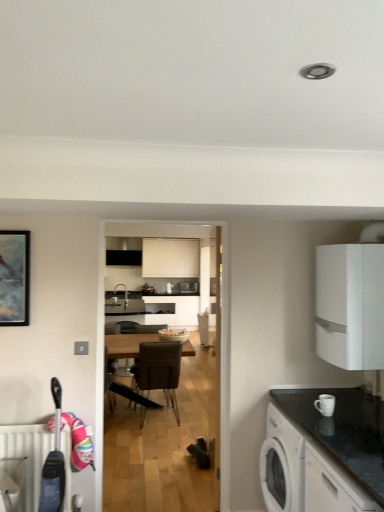
This screenshot has height=512, width=384. I want to click on white matte cabinet at right, positioned as the 1th cabinetry in back-to-front order, so click(x=350, y=305).

What is the approximate width of matte white bowl at center?

It is 15.05 inches.

Find the location of a particular element. This screenshot has width=384, height=512. white matte cabinet at lower right, placed as the 1th cabinetry when sorted from front to back is located at coordinates (332, 485).

The height and width of the screenshot is (512, 384). I want to click on white ceramic mug at lower right, so click(x=325, y=404).

Does point (331, 412) come behind point (171, 335)?

No, it is in front of (171, 335).

Can you confirm if white ceramic mug at lower right is wider than matte white bowl at center?

No.

Based on the photo, is white ceramic mug at lower right oriented away from matte white bowl at center?

No.

From a real-world perspective, count 2nd cabinetrys upward from the wooden table at center and point to it. Please provide its 2D coordinates.

[(350, 305)]

Considering the sizes of objects wooden table at center and white matte cabinet at right, which ranks as the 2th cabinetry in front-to-back order, in the image provided, who is bigger, wooden table at center or white matte cabinet at right, which ranks as the 2th cabinetry in front-to-back order,?

wooden table at center.

From a real-world perspective, which is physically below, wooden table at center or white matte cabinet at right, which ranks as the 2th cabinetry in front-to-back order?

From a 3D spatial view, wooden table at center is below.

Does wooden table at center turn towards white matte cabinet at right, which ranks as the 2th cabinetry in front-to-back order?

No, wooden table at center is not oriented towards white matte cabinet at right, which ranks as the 2th cabinetry in front-to-back order.

Looking at the image, does white matte cabinet at right, the second cabinetry positioned from the bottom, seem bigger or smaller compared to wooden table at center?

In the image, white matte cabinet at right, the second cabinetry positioned from the bottom, appears to be smaller than wooden table at center.

Considering the relative sizes of white matte cabinet at right, the first cabinetry when ordered from top to bottom, and wooden table at center in the image provided, is white matte cabinet at right, the first cabinetry when ordered from top to bottom, taller than wooden table at center?

Incorrect, the height of white matte cabinet at right, the first cabinetry when ordered from top to bottom, is not larger of that of wooden table at center.

Identify the location of the 1st cabinetry in front of the wooden table at center. (350, 305).

Can we say wooden table at center lies outside brown leather chair at center?

Yes, wooden table at center is located beyond the bounds of brown leather chair at center.

Who is bigger, wooden table at center or brown leather chair at center?

wooden table at center.

Would you consider wooden table at center to be distant from brown leather chair at center?

Yes, wooden table at center is far from brown leather chair at center.

From the picture: Is wooden table at center aimed at brown leather chair at center?

Yes.

Is white textured radiator at lower left wider or thinner than wooden table at center?

In the image, white textured radiator at lower left appears to be more narrow than wooden table at center.

Which object is closer to the camera taking this photo, white textured radiator at lower left or wooden table at center?

Positioned in front is white textured radiator at lower left.

Based on the photo, which object is positioned more to the right, white textured radiator at lower left or wooden table at center?

Positioned to the right is wooden table at center.

Consider the image. Between black granite countertop at right and white matte cabinet at lower right, marked as the second cabinetry in a top-to-bottom arrangement, which one has smaller size?

Smaller between the two is black granite countertop at right.

Can you confirm if black granite countertop at right is shorter than white matte cabinet at lower right, placed as the 2th cabinetry when sorted from back to front?

Yes.

You are a GUI agent. You are given a task and a screenshot of the screen. Output one action in this format:
    pyautogui.click(x=<x>, y=<y>)
    Task: Click on the countertop above the white matte cabinet at lower right, the 1th cabinetry in the bottom-to-top sequence (from a real-world perspective)
    
    Given the screenshot: What is the action you would take?
    pyautogui.click(x=344, y=430)

How many degrees apart are the facing directions of black granite countertop at right and white matte cabinet at lower right, marked as the second cabinetry in a top-to-bottom arrangement?

They differ by 0.00233 degrees in their facing directions.

From a real-world perspective, is white matte cabinet at lower right, placed as the 2th cabinetry when sorted from back to front, on top of white textured radiator at lower left?

Indeed, from a real-world perspective, white matte cabinet at lower right, placed as the 2th cabinetry when sorted from back to front, stands above white textured radiator at lower left.

Can you tell me how much white matte cabinet at lower right, the 1th cabinetry in the bottom-to-top sequence, and white textured radiator at lower left differ in facing direction?

The angular difference between white matte cabinet at lower right, the 1th cabinetry in the bottom-to-top sequence, and white textured radiator at lower left is 89.3 degrees.

Is white matte cabinet at lower right, placed as the 1th cabinetry when sorted from front to back, far away from white textured radiator at lower left?

Yes, white matte cabinet at lower right, placed as the 1th cabinetry when sorted from front to back, and white textured radiator at lower left are quite far apart.

At what (x,y) coordinates should I click in order to perform the action: click on kitchen appliance that appears on the right of matte white bowl at center. Please return your answer as a coordinate pair (x, y). Looking at the image, I should click on (325, 404).

Find the location of a particular element. The image size is (384, 512). the 2nd cabinetry above the wooden table at center (from the image's perspective) is located at coordinates (350, 305).

From the picture: Based on their spatial positions, is matte white bowl at center or white matte cabinet at right, which ranks as the 2th cabinetry in front-to-back order, closer to white textured radiator at lower left?

white matte cabinet at right, which ranks as the 2th cabinetry in front-to-back order, is positioned closer to the anchor white textured radiator at lower left.

Which object lies further to the anchor point white textured radiator at lower left, white matte cabinet at lower right, marked as the second cabinetry in a top-to-bottom arrangement, or wooden table at center?

The object further to white textured radiator at lower left is wooden table at center.

From the image, which object appears to be nearer to white matte cabinet at lower right, placed as the 2th cabinetry when sorted from back to front, wooden table at center or black granite countertop at right?

black granite countertop at right is closer to white matte cabinet at lower right, placed as the 2th cabinetry when sorted from back to front.

Looking at the image, which one is located further to black granite countertop at right, white matte cabinet at right, the second cabinetry positioned from the bottom, or white matte cabinet at lower right, marked as the second cabinetry in a top-to-bottom arrangement?

white matte cabinet at right, the second cabinetry positioned from the bottom, is positioned further to the anchor black granite countertop at right.

Which object lies nearer to the anchor point wooden table at center, white ceramic mug at lower right or black granite countertop at right?

Among the two, black granite countertop at right is located nearer to wooden table at center.

Based on their spatial positions, is white matte cabinet at right, which ranks as the 2th cabinetry in front-to-back order, or black granite countertop at right closer to brown leather chair at center?

The object closer to brown leather chair at center is black granite countertop at right.

Estimate the real-world distances between objects in this image. Which object is closer to black granite countertop at right, brown leather chair at center or matte white bowl at center?

brown leather chair at center lies closer to black granite countertop at right than the other object.

Which object lies further to the anchor point white matte cabinet at lower right, marked as the second cabinetry in a top-to-bottom arrangement, white matte cabinet at right, which ranks as the 2th cabinetry in front-to-back order, or black granite countertop at right?

Among the two, white matte cabinet at right, which ranks as the 2th cabinetry in front-to-back order, is located further to white matte cabinet at lower right, marked as the second cabinetry in a top-to-bottom arrangement.

I want to click on chair between white textured radiator at lower left and matte white bowl at center from front to back, so click(159, 370).

Where is `cabinetry between white matte cabinet at lower right, placed as the 2th cabinetry when sorted from back to front, and wooden table at center, along the z-axis`? The height and width of the screenshot is (512, 384). cabinetry between white matte cabinet at lower right, placed as the 2th cabinetry when sorted from back to front, and wooden table at center, along the z-axis is located at coordinates [350, 305].

You are a GUI agent. You are given a task and a screenshot of the screen. Output one action in this format:
    pyautogui.click(x=<x>, y=<y>)
    Task: Click on the chair located between black granite countertop at right and wooden table at center in the depth direction
    The image size is (384, 512).
    Given the screenshot: What is the action you would take?
    pyautogui.click(x=159, y=370)

Where is `chair between black granite countertop at right and matte white bowl at center along the z-axis`? The height and width of the screenshot is (512, 384). chair between black granite countertop at right and matte white bowl at center along the z-axis is located at coordinates (159, 370).